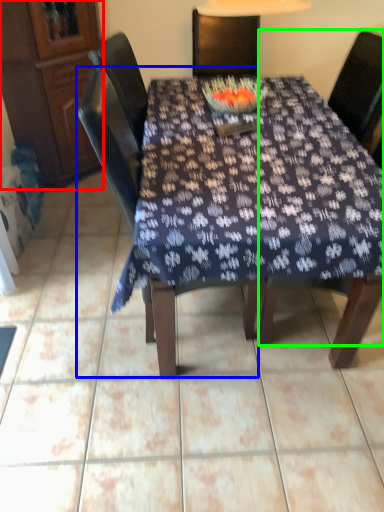
Question: Estimate the real-world distances between objects in this image. Which object is farther from cabinetry (highlighted by a red box), chair (highlighted by a blue box) or chair (highlighted by a green box)?

Choices:
 (A) chair
 (B) chair

Answer: (B)